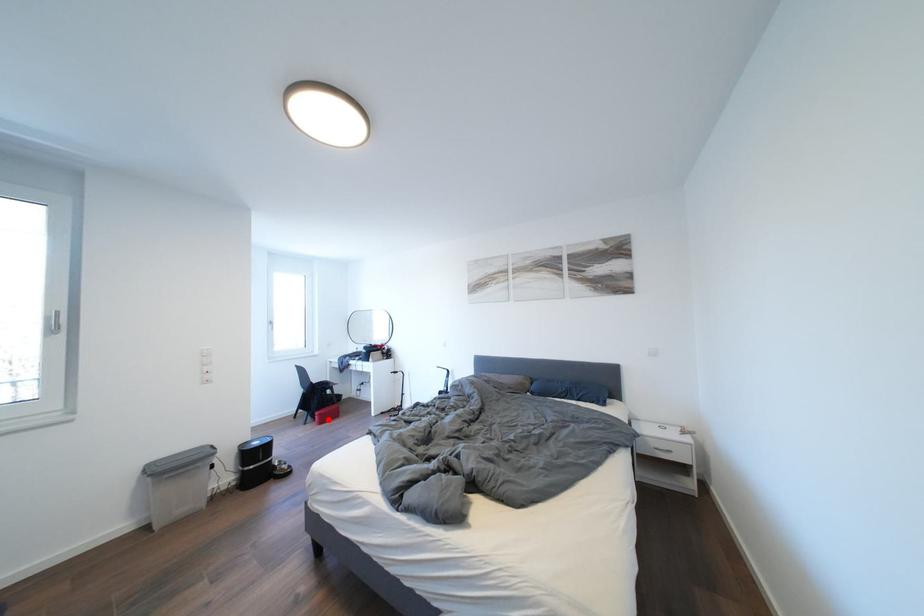
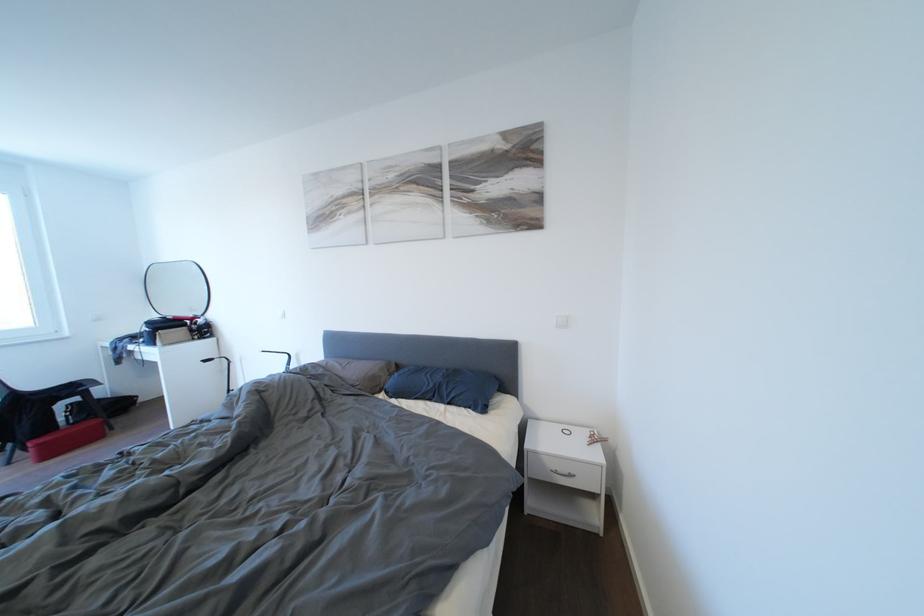
Locate, in the second image, the point that corresponds to the highlighted location in the first image.

(46, 450)